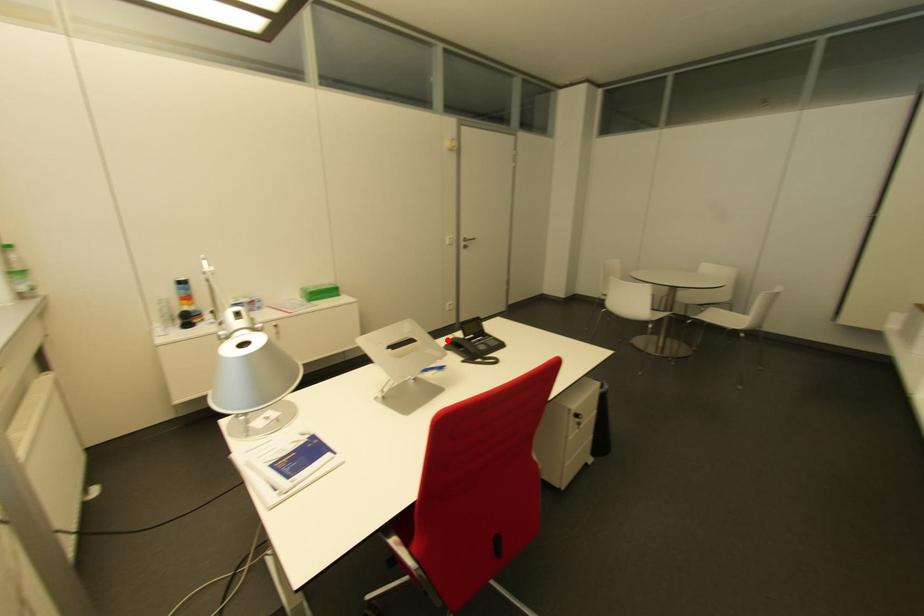
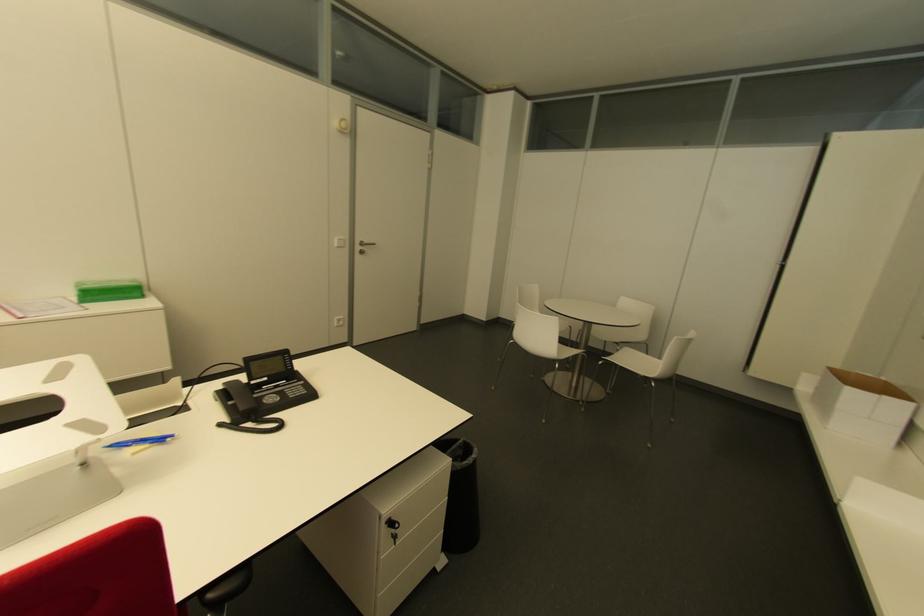
Locate, in the second image, the point that corresponds to the highlighted location in the first image.

(223, 384)